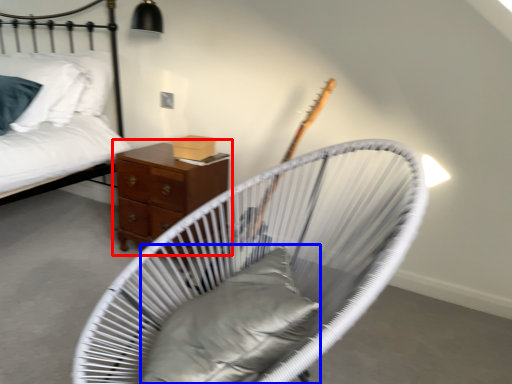
Question: Among these objects, which one is farthest to the camera, nightstand (highlighted by a red box) or pillow (highlighted by a blue box)?

Choices:
 (A) nightstand
 (B) pillow

Answer: (A)